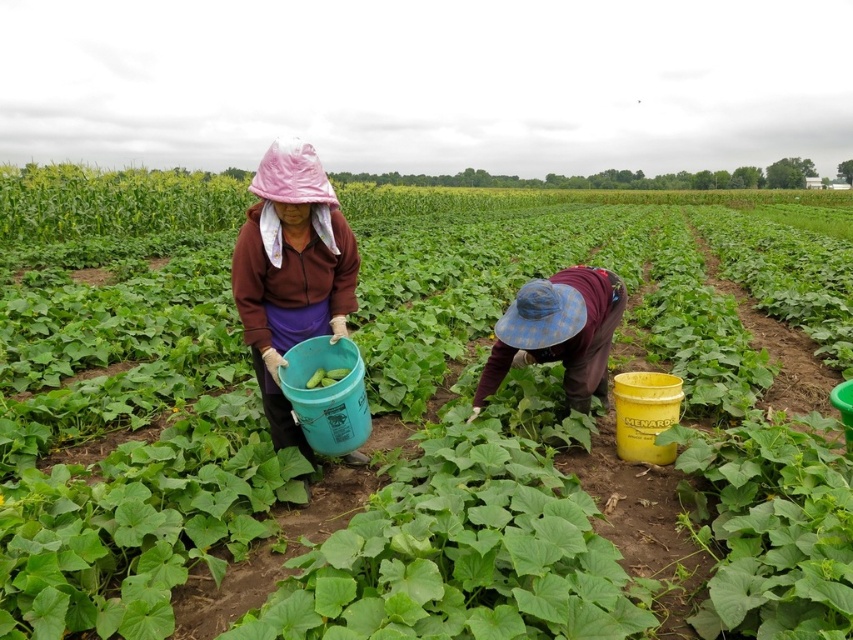
Between point (352, 289) and point (602, 392), which one is positioned behind?

Point (602, 392)

Which is above, matte brown jacket at center or blue plaid hat at center?

matte brown jacket at center

Is point (283, 170) behind point (585, 316)?

No, (283, 170) is in front of (585, 316).

Where is `matte brown jacket at center`? matte brown jacket at center is located at coordinates (291, 273).

Measure the distance between blue plaid hat at center and green matte cucumber at center.

1.27 meters

Based on the photo, which is more to the right, blue plaid hat at center or green matte cucumber at center?

Positioned to the right is blue plaid hat at center.

Describe the element at coordinates (567, 337) in the screenshot. I see `blue plaid hat at center` at that location.

Find the location of a particular element. blue plaid hat at center is located at coordinates (567, 337).

The height and width of the screenshot is (640, 853). Describe the element at coordinates (125, 428) in the screenshot. I see `green leafy plant at center` at that location.

Does point (489, 273) come behind point (337, 374)?

Yes, point (489, 273) is farther from viewer.

Find the location of a particular element. Image resolution: width=853 pixels, height=640 pixels. green leafy plant at center is located at coordinates (125, 428).